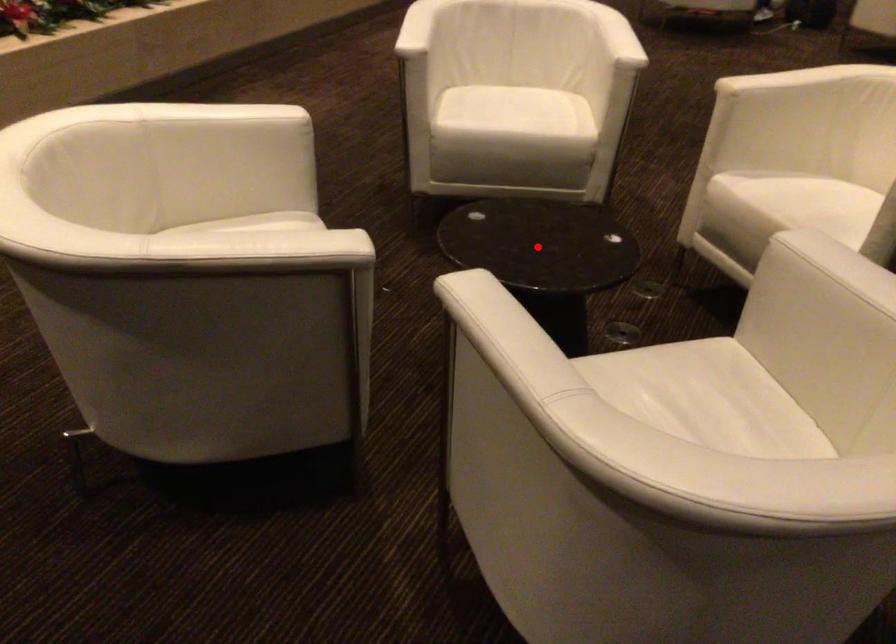
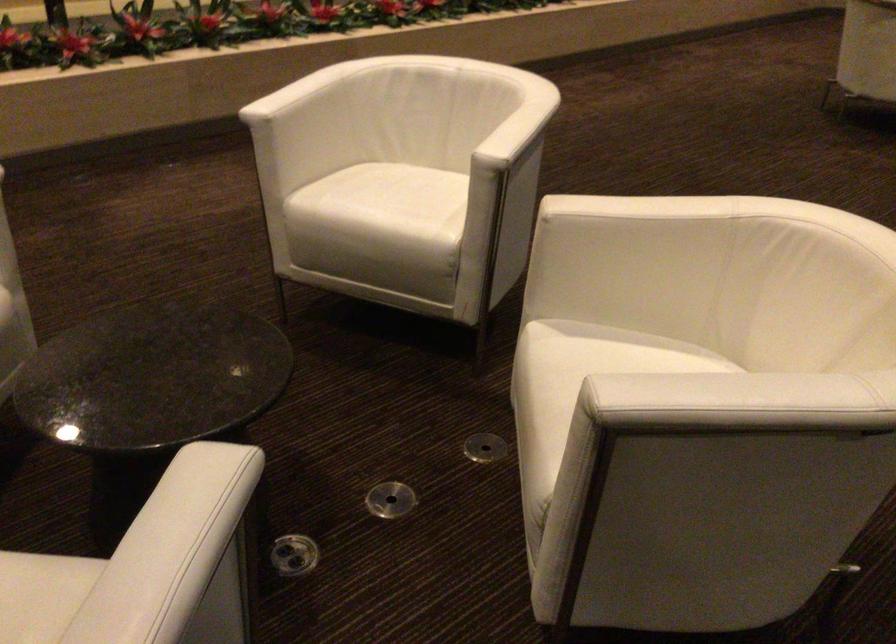
Question: I am providing you with two images of the same scene from different viewpoints. Given a red point in image1, look at the same physical point in image2. Is it:

Choices:
 (A) Closer to the viewpoint
 (B) Farther from the viewpoint

Answer: (A)